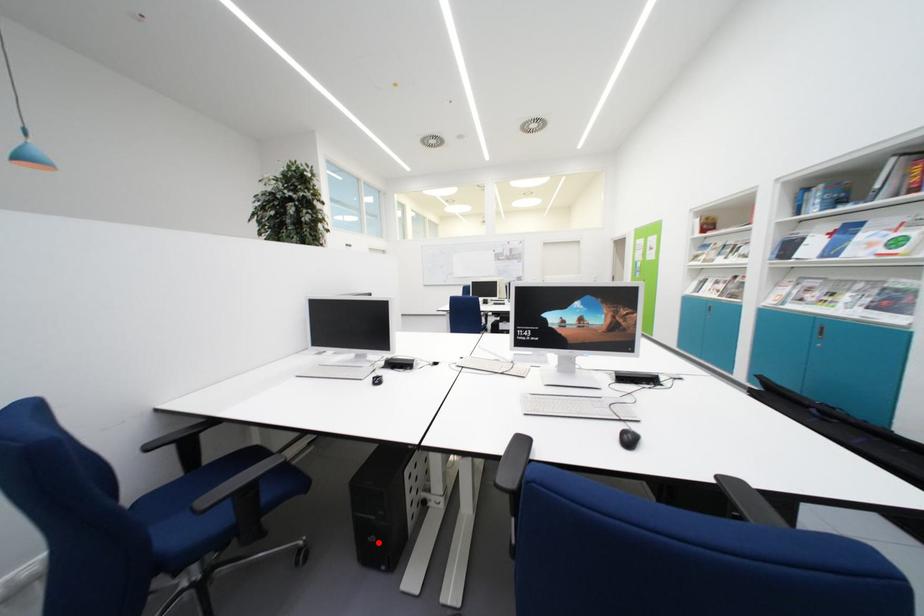
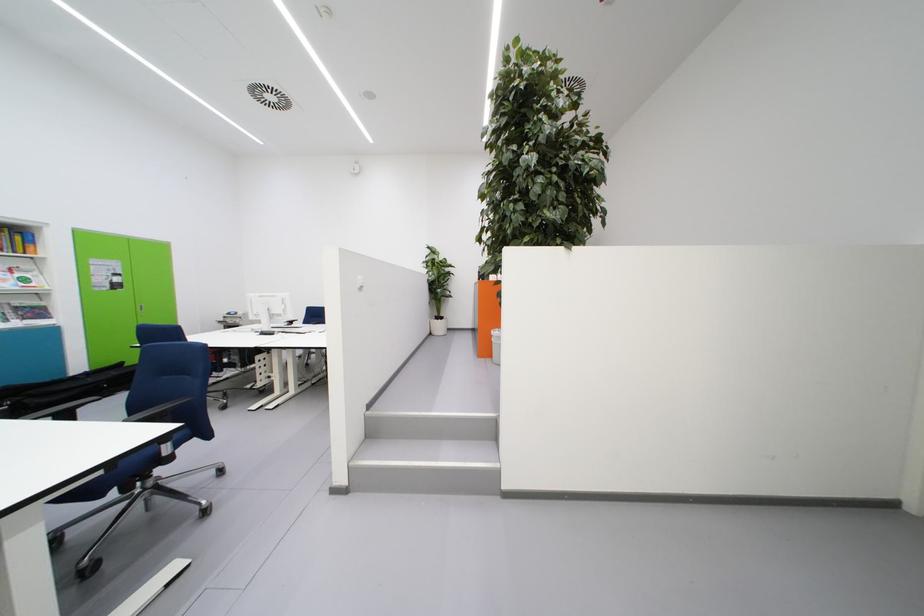
Question: I am providing you with two images of the same scene from different viewpoints. A red point is marked on the first image. Is the red point's position out of view in image 2?

Choices:
 (A) Yes
 (B) No

Answer: (A)